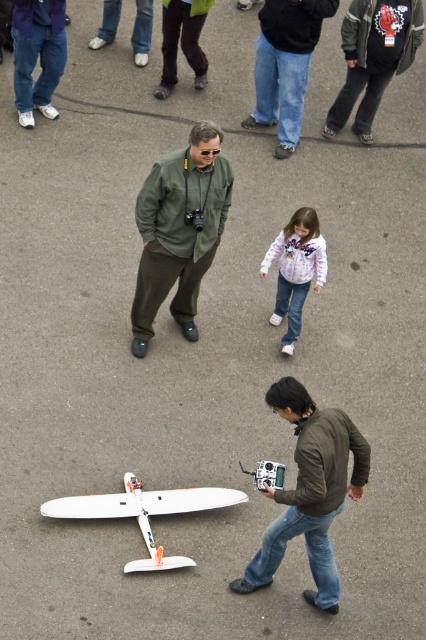
What is the coordinate of the denim pants at upper left?

The denim pants at upper left is located at coordinate point (37, 54).

You are standing at the point marked as point (178, 230) and want to take a photo of the green matte jacket at center. Is the green matte jacket at center visible from your current position?

The green matte jacket at center is located at point (178, 230), so you are standing directly on top of it. Therefore, you cannot take a photo of it from your current position because you are at the same location.

You are a photographer standing at the back of the scene. You want to take a photo of the white fleece jacket at center without the denim pants at upper left blocking it. Is this possible?

→ The white fleece jacket at center is behind denim pants at upper left, so it will be blocked by the denim pants at upper left. You cannot take a photo of the white fleece jacket at center without the denim pants at upper left blocking it.